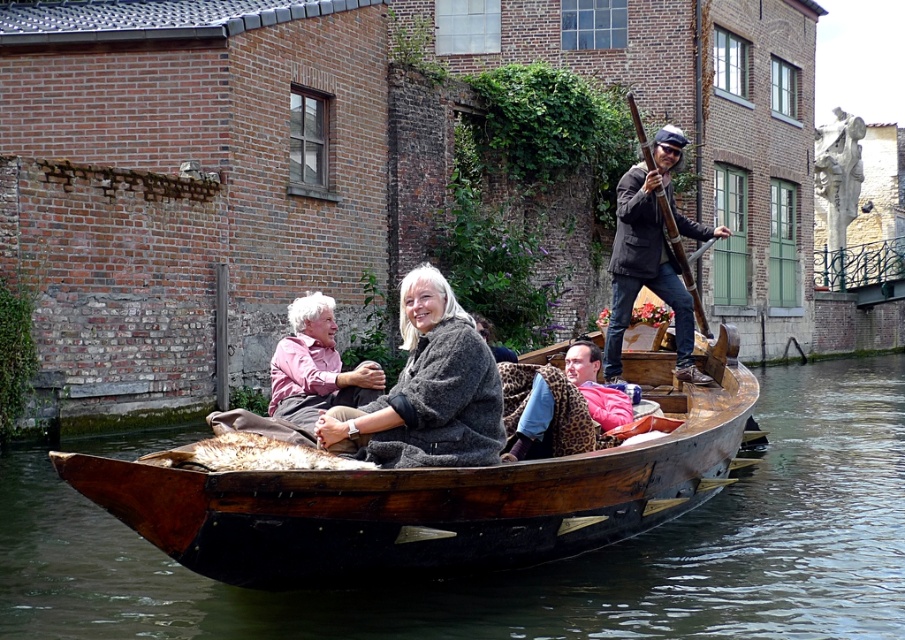
You are a tourist standing on the canal bank and see two jackets in the boat. Which jacket is taller, the dark brown leather jacket at upper right or the leopard print jacket at center?

The dark brown leather jacket at upper right is taller than the leopard print jacket at center.

You are a tourist standing on the canal bridge. You want to take a photo of the wooden canoe at center and the fuzzy gray sweater at center. Which object should you zoom in on to capture both in the frame without moving the camera?

The wooden canoe at center is wider than the fuzzy gray sweater at center, so you should zoom in on the wooden canoe at center to ensure both objects fit in the frame.

You are standing on a bridge overlooking the wooden canoe at center. You want to throw a small object into the canoe. Considering the distance, is it feasible to do so accurately?

The wooden canoe at center is 27.22 meters away from the camera, so it might be challenging to throw a small object accurately from that distance.